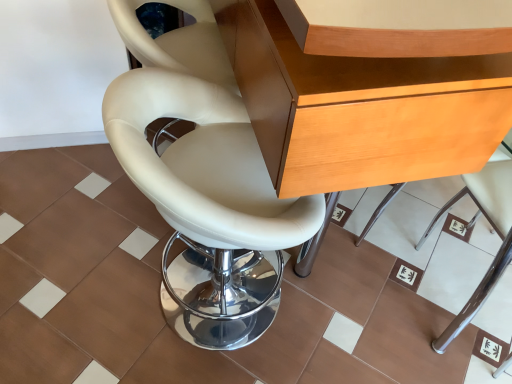
Question: From a real-world perspective, is white leather chair at center, which appears as the 2th chair when viewed from the right, over brown matte tile at center?

Choices:
 (A) no
 (B) yes

Answer: (B)

Question: Are white leather chair at center, positioned as the first chair in left-to-right order, and brown matte tile at center making contact?

Choices:
 (A) no
 (B) yes

Answer: (A)

Question: Is white leather chair at center, positioned as the first chair in left-to-right order, to the right of brown matte tile at center from the viewer's perspective?

Choices:
 (A) yes
 (B) no

Answer: (B)

Question: From the image's perspective, is white leather chair at center, positioned as the first chair in left-to-right order, located beneath brown matte tile at center?

Choices:
 (A) yes
 (B) no

Answer: (B)

Question: Does white leather chair at center, positioned as the first chair in left-to-right order, lie in front of brown matte tile at center?

Choices:
 (A) no
 (B) yes

Answer: (B)

Question: Is brown matte tile at center situated inside wooden desk at center or outside?

Choices:
 (A) inside
 (B) outside

Answer: (B)

Question: From their relative heights in the image, would you say brown matte tile at center is taller or shorter than wooden desk at center?

Choices:
 (A) short
 (B) tall

Answer: (A)

Question: From the image's perspective, is brown matte tile at center located above or below wooden desk at center?

Choices:
 (A) below
 (B) above

Answer: (A)

Question: Is brown matte tile at center bigger or smaller than wooden desk at center?

Choices:
 (A) small
 (B) big

Answer: (A)

Question: In terms of size, does white leather chair at center, which appears as the 2th chair when viewed from the right, appear bigger or smaller than wooden desk at center?

Choices:
 (A) small
 (B) big

Answer: (A)

Question: Is white leather chair at center, which appears as the 2th chair when viewed from the right, taller or shorter than wooden desk at center?

Choices:
 (A) tall
 (B) short

Answer: (B)

Question: In terms of width, does white leather chair at center, positioned as the first chair in left-to-right order, look wider or thinner when compared to wooden desk at center?

Choices:
 (A) wide
 (B) thin

Answer: (B)

Question: Is white leather chair at center, which appears as the 2th chair when viewed from the right, to the left or to the right of wooden desk at center in the image?

Choices:
 (A) right
 (B) left

Answer: (B)

Question: Considering their positions, is wooden desk at center located in front of or behind white leather chair at lower right, which is the first chair from right to left?

Choices:
 (A) front
 (B) behind

Answer: (A)

Question: From a real-world perspective, is wooden desk at center physically located above or below white leather chair at lower right, the second chair viewed from the left?

Choices:
 (A) above
 (B) below

Answer: (A)